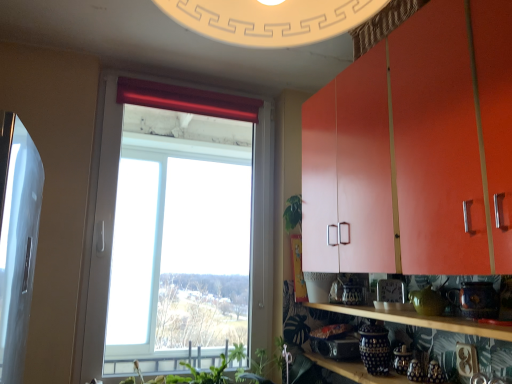
Question: From a real-world perspective, is transparent glass window at center physically above wooden shelf at lower right, acting as the 2th shelf starting from the bottom?

Choices:
 (A) no
 (B) yes

Answer: (B)

Question: From the image's perspective, is transparent glass window at center under wooden shelf at lower right, the first shelf in the top-to-bottom sequence?

Choices:
 (A) no
 (B) yes

Answer: (A)

Question: Is the depth of transparent glass window at center greater than that of wooden shelf at lower right, the first shelf in the top-to-bottom sequence?

Choices:
 (A) yes
 (B) no

Answer: (A)

Question: From the image's perspective, is transparent glass window at center on top of wooden shelf at lower right, the first shelf in the top-to-bottom sequence?

Choices:
 (A) no
 (B) yes

Answer: (B)

Question: Does transparent glass window at center have a lesser width compared to wooden shelf at lower right, acting as the 2th shelf starting from the bottom?

Choices:
 (A) no
 (B) yes

Answer: (B)

Question: Considering the relative positions of matte orange cabinet at upper right and blue and white ceramic jars at lower center, positioned as the 1th shelf in bottom-to-top order, in the image provided, is matte orange cabinet at upper right to the left or to the right of blue and white ceramic jars at lower center, positioned as the 1th shelf in bottom-to-top order,?

Choices:
 (A) right
 (B) left

Answer: (A)

Question: Is matte orange cabinet at upper right taller or shorter than blue and white ceramic jars at lower center, positioned as the 1th shelf in bottom-to-top order?

Choices:
 (A) short
 (B) tall

Answer: (B)

Question: In terms of size, does matte orange cabinet at upper right appear bigger or smaller than blue and white ceramic jars at lower center, positioned as the 1th shelf in bottom-to-top order?

Choices:
 (A) small
 (B) big

Answer: (B)

Question: Is matte orange cabinet at upper right in front of or behind blue and white ceramic jars at lower center, positioned as the 1th shelf in bottom-to-top order, in the image?

Choices:
 (A) front
 (B) behind

Answer: (A)

Question: Would you say blue and white ceramic jars at lower center, the 2th shelf in the top-to-bottom sequence, is inside or outside wooden shelf at lower right, the first shelf in the top-to-bottom sequence?

Choices:
 (A) outside
 (B) inside

Answer: (A)

Question: Looking at their shapes, would you say blue and white ceramic jars at lower center, positioned as the 1th shelf in bottom-to-top order, is wider or thinner than wooden shelf at lower right, acting as the 2th shelf starting from the bottom?

Choices:
 (A) wide
 (B) thin

Answer: (A)

Question: Considering the positions of blue and white ceramic jars at lower center, positioned as the 1th shelf in bottom-to-top order, and wooden shelf at lower right, the first shelf in the top-to-bottom sequence, in the image, is blue and white ceramic jars at lower center, positioned as the 1th shelf in bottom-to-top order, taller or shorter than wooden shelf at lower right, the first shelf in the top-to-bottom sequence,?

Choices:
 (A) short
 (B) tall

Answer: (B)

Question: From a real-world perspective, is blue and white ceramic jars at lower center, the 2th shelf in the top-to-bottom sequence, above or below wooden shelf at lower right, the first shelf in the top-to-bottom sequence?

Choices:
 (A) above
 (B) below

Answer: (B)

Question: Is transparent glass window at center bigger or smaller than matte orange cabinet at upper right?

Choices:
 (A) big
 (B) small

Answer: (B)

Question: Which is correct: transparent glass window at center is inside matte orange cabinet at upper right, or outside of it?

Choices:
 (A) outside
 (B) inside

Answer: (A)